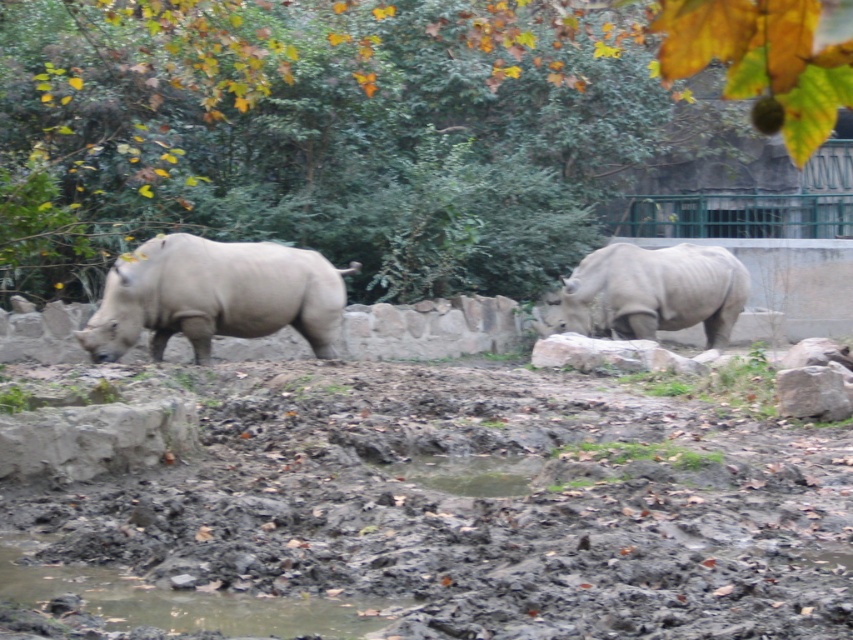
How far apart are damp mud at lower center and gray rough rock at right?

damp mud at lower center is 17.67 feet away from gray rough rock at right.

Between damp mud at lower center and gray rough rock at right, which one has more height?

gray rough rock at right

At what (x,y) coordinates should I click in order to perform the action: click on damp mud at lower center. Please return your answer as a coordinate pair (x, y). Looking at the image, I should click on (480, 504).

This screenshot has width=853, height=640. What do you see at coordinates (213, 296) in the screenshot?
I see `matte gray rhinoceros at left` at bounding box center [213, 296].

This screenshot has width=853, height=640. In order to click on matte gray rhinoceros at left in this screenshot , I will do `click(213, 296)`.

Measure the distance between matte gray rhinoceros at left and camera.

matte gray rhinoceros at left and camera are 45.32 feet apart.

The height and width of the screenshot is (640, 853). What are the coordinates of `matte gray rhinoceros at left` in the screenshot? It's located at (213, 296).

Which is in front, point (316, 148) or point (399, 472)?

Point (399, 472) is in front.

Where is `green leafy tree at upper center`? The width and height of the screenshot is (853, 640). green leafy tree at upper center is located at coordinates (378, 125).